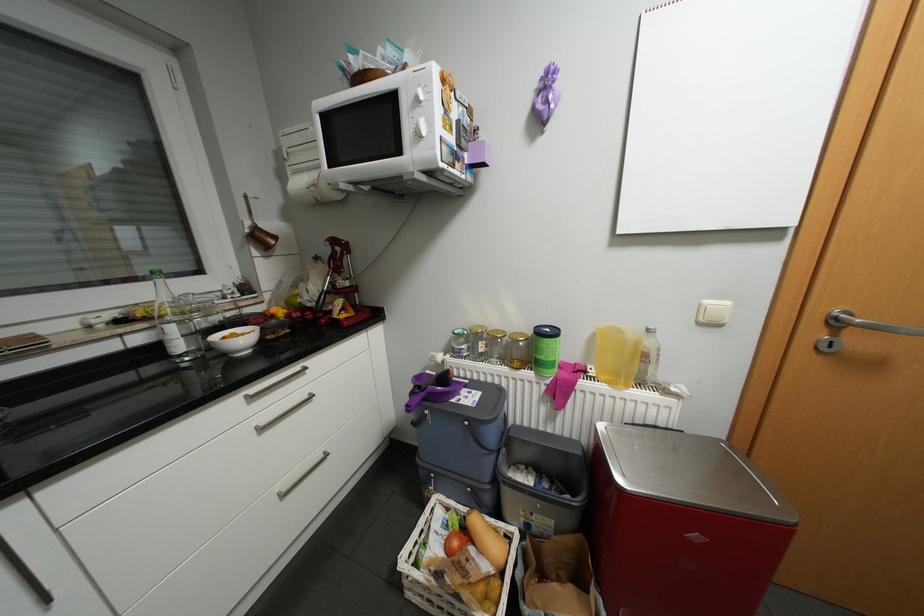
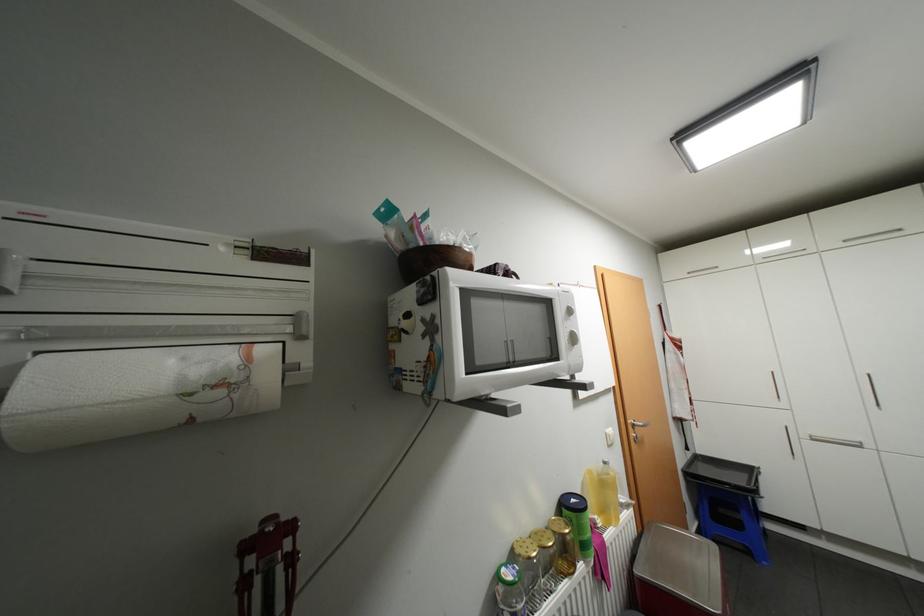
Locate, in the second image, the point that corresponds to point (294, 159) in the first image.

(6, 291)